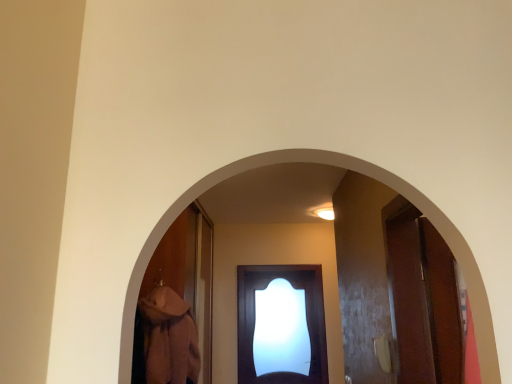
Question: Is white glossy light at upper center thinner than smooth wooden archway at center?

Choices:
 (A) yes
 (B) no

Answer: (B)

Question: From the image's perspective, is white glossy light at upper center beneath smooth wooden archway at center?

Choices:
 (A) no
 (B) yes

Answer: (B)

Question: Can you confirm if white glossy light at upper center is shorter than smooth wooden archway at center?

Choices:
 (A) yes
 (B) no

Answer: (A)

Question: Can you confirm if white glossy light at upper center is positioned to the right of smooth wooden archway at center?

Choices:
 (A) no
 (B) yes

Answer: (B)

Question: Is white glossy light at upper center not within smooth wooden archway at center?

Choices:
 (A) no
 (B) yes

Answer: (B)

Question: Does white glossy light at upper center lie behind smooth wooden archway at center?

Choices:
 (A) yes
 (B) no

Answer: (A)

Question: From a real-world perspective, is matte dark wood door at center positioned under smooth wooden archway at center based on gravity?

Choices:
 (A) no
 (B) yes

Answer: (B)

Question: Is matte dark wood door at center outside smooth wooden archway at center?

Choices:
 (A) no
 (B) yes

Answer: (B)

Question: Is smooth wooden archway at center completely or partially inside matte dark wood door at center?

Choices:
 (A) no
 (B) yes

Answer: (A)

Question: Can you confirm if matte dark wood door at center is thinner than smooth wooden archway at center?

Choices:
 (A) no
 (B) yes

Answer: (A)

Question: Does matte dark wood door at center have a greater height compared to smooth wooden archway at center?

Choices:
 (A) no
 (B) yes

Answer: (B)

Question: Can you confirm if matte dark wood door at center is positioned to the left of smooth wooden archway at center?

Choices:
 (A) no
 (B) yes

Answer: (A)

Question: Is matte dark wood door at center bigger than white glossy light at upper center?

Choices:
 (A) no
 (B) yes

Answer: (B)